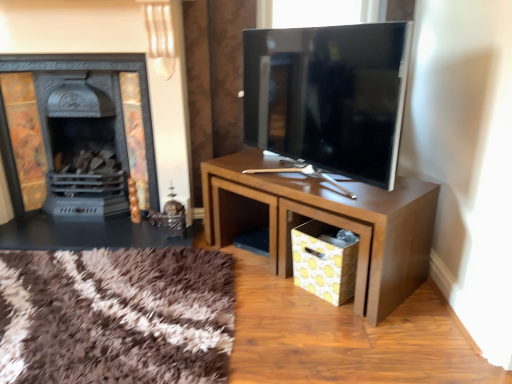
Where is `free point above brown wood table at center (from a real-world perspective)`? free point above brown wood table at center (from a real-world perspective) is located at coordinates point(300,176).